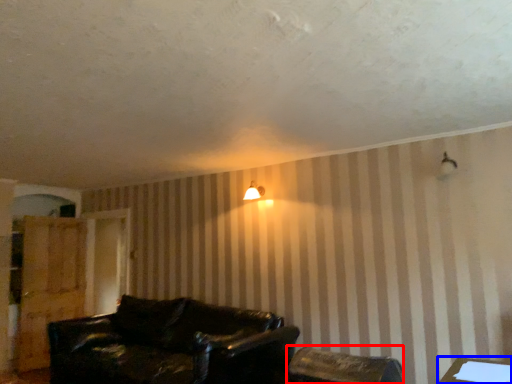
Question: Which object is further to the camera taking this photo, chair (highlighted by a red box) or table (highlighted by a blue box)?

Choices:
 (A) chair
 (B) table

Answer: (A)